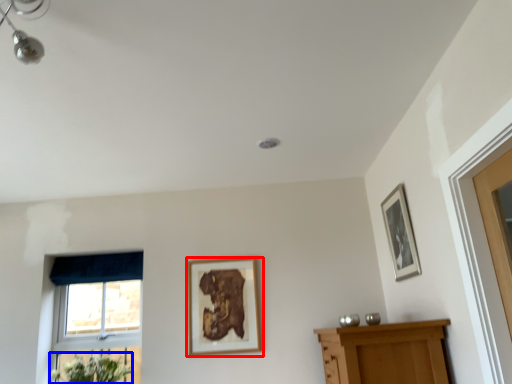
Question: Which point is further to the camera, picture frame (highlighted by a red box) or flower (highlighted by a blue box)?

Choices:
 (A) picture frame
 (B) flower

Answer: (A)